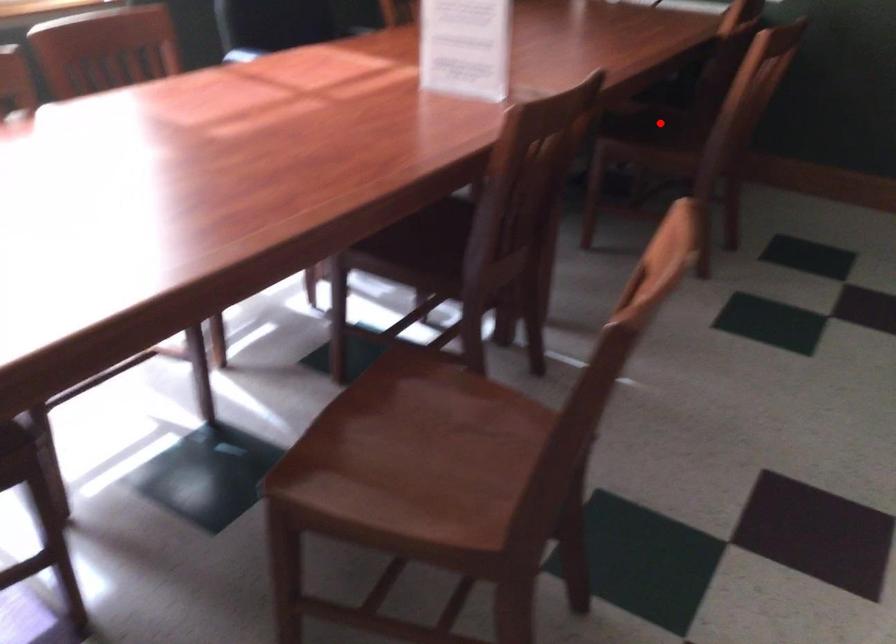
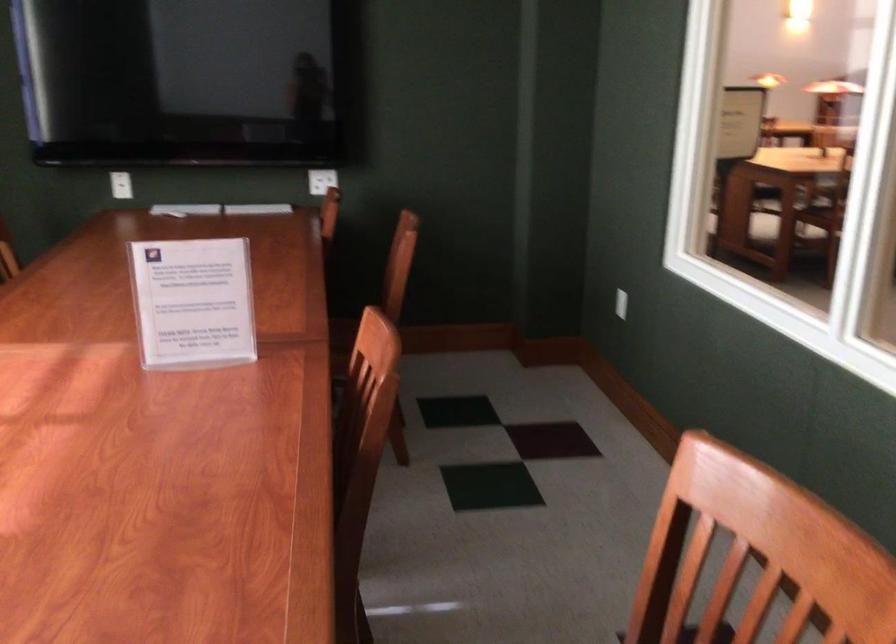
Question: I am providing you with two images of the same scene from different viewpoints. A red point is marked on the first image. At the location where the point appears in image 1, is it still visible in image 2?

Choices:
 (A) Yes
 (B) No

Answer: (B)